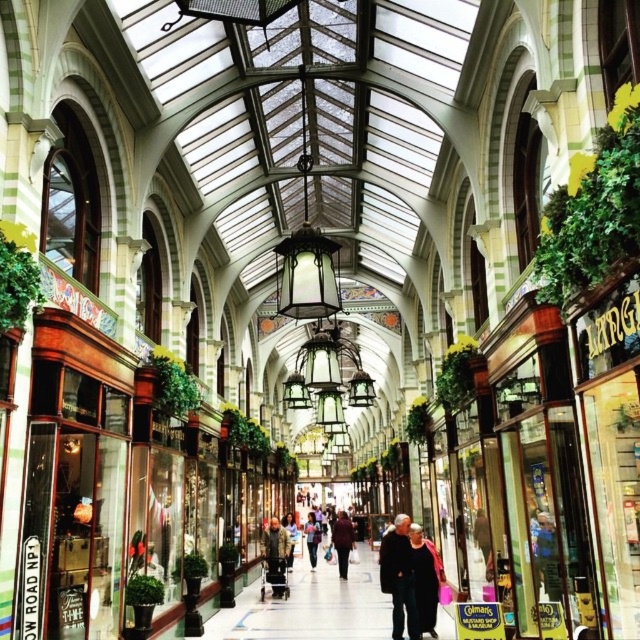
You are a customer in the shopping arcade and see two coats hanging on a rack at the center of the store. The dark gray coat at center and the camouflage jacket at center. Which one is smaller?

The dark gray coat at center is smaller than the camouflage jacket at center.

You are a delivery person standing at the entrance of the shopping arcade. You need to place a package on the dark gray coat at center and the camouflage jacket at center. However, the delivery robot you are using has a maximum delivery range of 100 feet. Can the robot deliver the package to both items?

The dark gray coat at center is 126.35 feet away from the camouflage jacket at center. Since the robot can only travel up to 100 feet, it cannot deliver the package to both items as the distance between them exceeds the robot